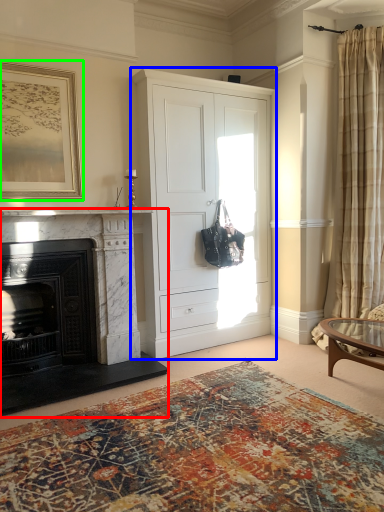
Question: Considering the real-world distances, which object is closest to fireplace (highlighted by a red box)? cabinetry (highlighted by a blue box) or picture frame (highlighted by a green box).

Choices:
 (A) cabinetry
 (B) picture frame

Answer: (A)